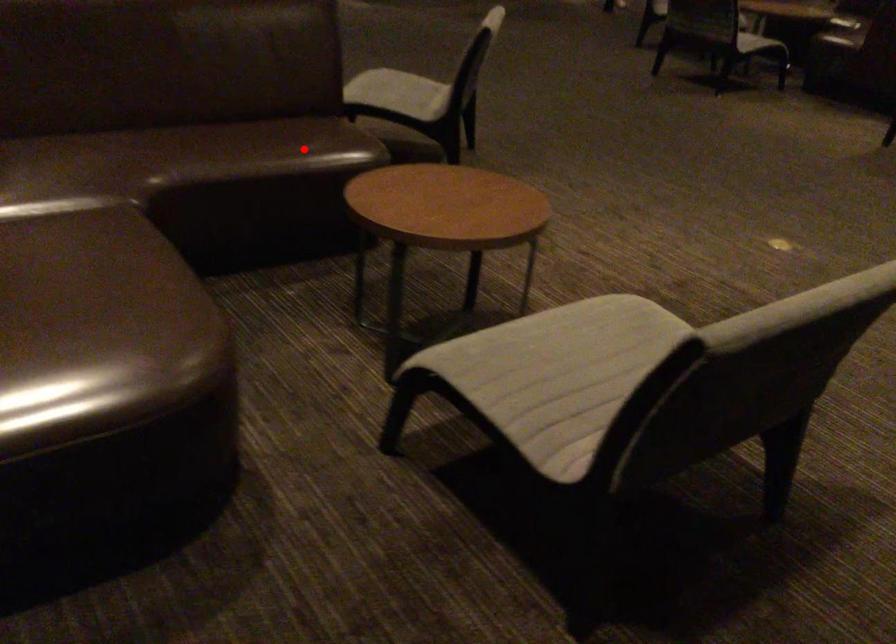
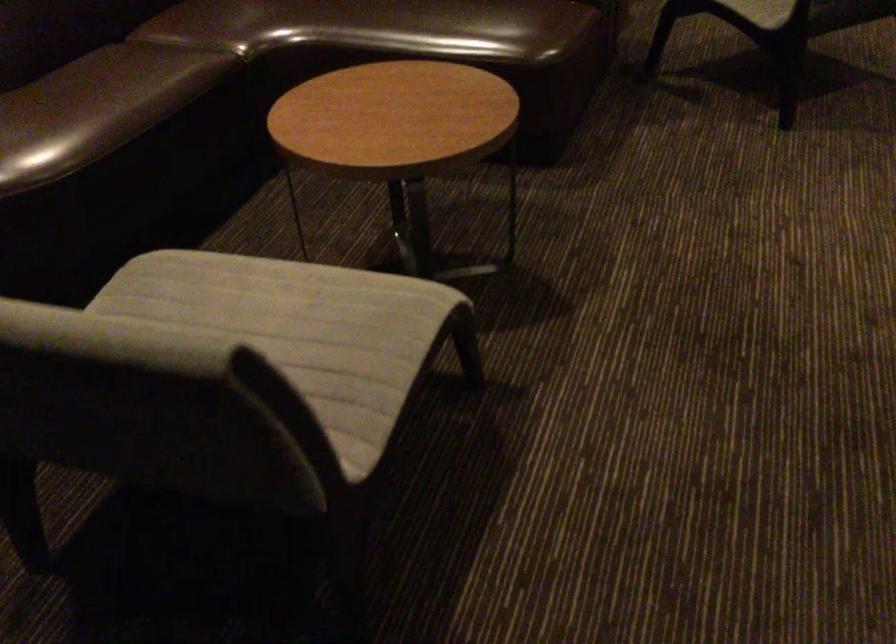
Question: I am providing you with two images of the same scene from different viewpoints. In image1, a red point is highlighted. Considering the same 3D point in image2, which of the following is correct?

Choices:
 (A) It is closer
 (B) It is farther

Answer: (A)